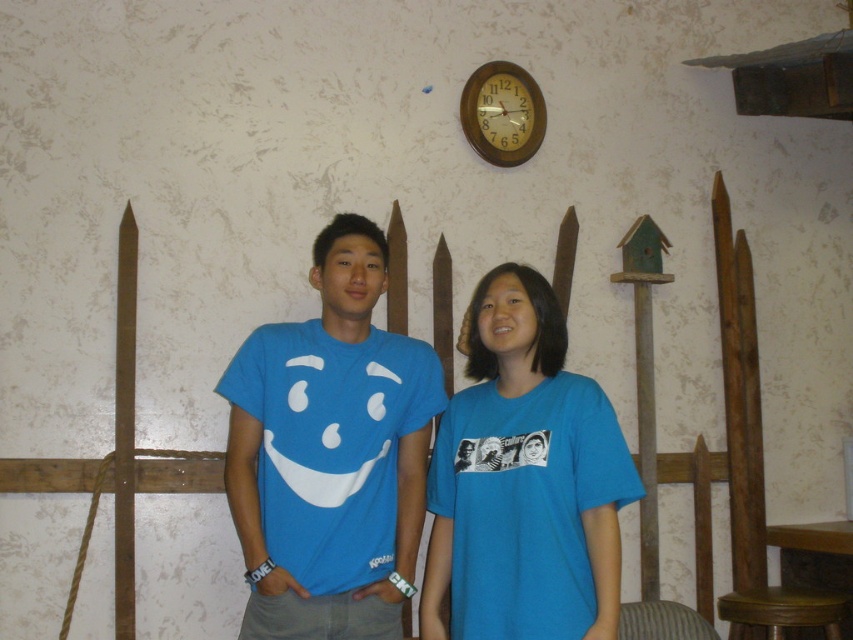
Can you confirm if blue cotton shirt at center is positioned to the left of wooden clock at upper center?

Yes, blue cotton shirt at center is to the left of wooden clock at upper center.

Is blue cotton shirt at center above wooden clock at upper center?

No.

Is point (561, 602) positioned after point (521, 122)?

That is False.

At what (x,y) coordinates should I click in order to perform the action: click on blue cotton shirt at center. Please return your answer as a coordinate pair (x, y). Looking at the image, I should click on (524, 481).

Is matte blue t-shirt at center to the right of blue cotton shirt at center from the viewer's perspective?

Incorrect, matte blue t-shirt at center is not on the right side of blue cotton shirt at center.

Is point (428, 422) more distant than point (523, 284)?

Yes, point (428, 422) is behind point (523, 284).

This screenshot has height=640, width=853. What are the coordinates of `matte blue t-shirt at center` in the screenshot? It's located at (329, 452).

Based on the photo, is matte blue t-shirt at center smaller than wooden clock at upper center?

Incorrect, matte blue t-shirt at center is not smaller in size than wooden clock at upper center.

Which of these two, matte blue t-shirt at center or wooden clock at upper center, stands taller?

With more height is matte blue t-shirt at center.

Where is `matte blue t-shirt at center`? matte blue t-shirt at center is located at coordinates (329, 452).

At what (x,y) coordinates should I click in order to perform the action: click on matte blue t-shirt at center. Please return your answer as a coordinate pair (x, y). This screenshot has width=853, height=640. Looking at the image, I should click on (329, 452).